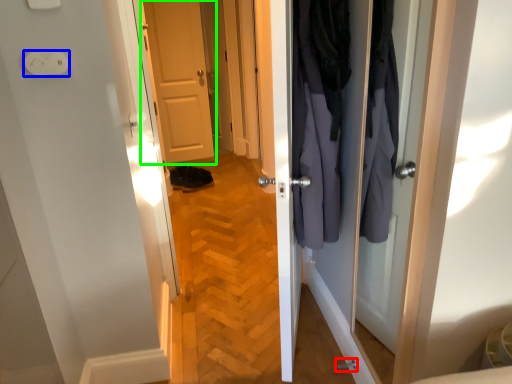
Question: Which is nearer to the door handle (highlighted by a red box)? electric outlet (highlighted by a blue box) or door (highlighted by a green box).

Choices:
 (A) electric outlet
 (B) door

Answer: (A)